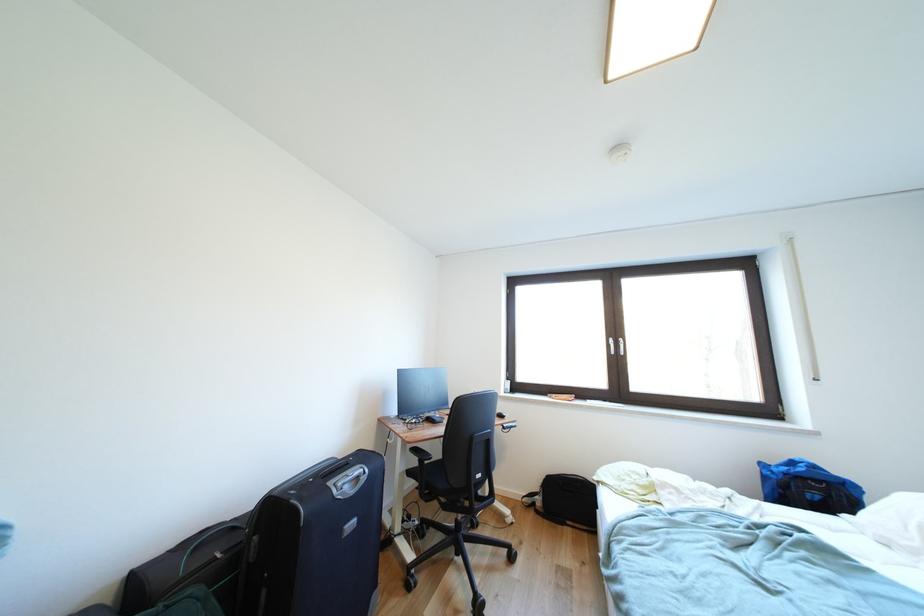
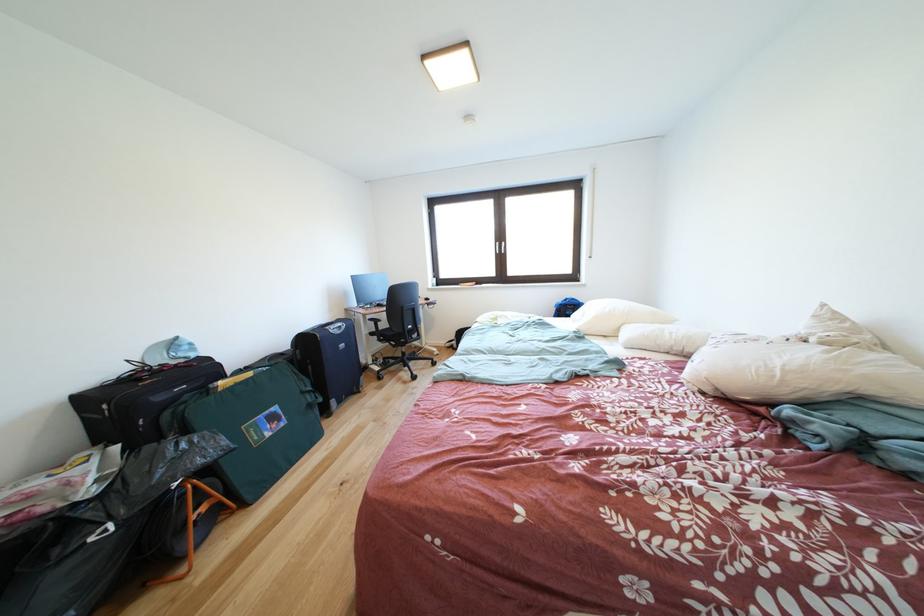
Find the pixel in the second image that matches point (454, 512) in the first image.

(403, 351)